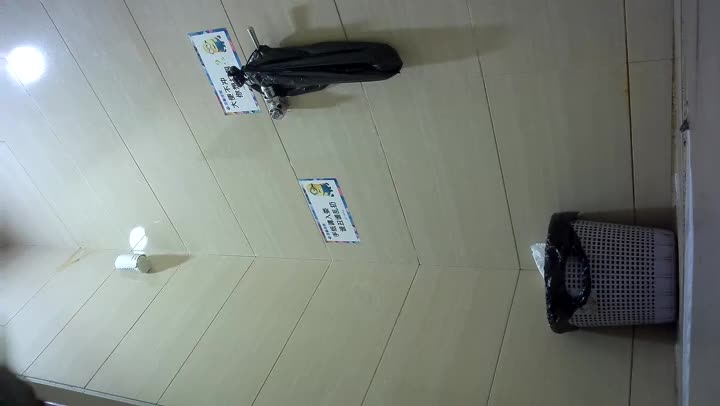
Locate an element on the screen. handle is located at coordinates (247, 43), (572, 278).